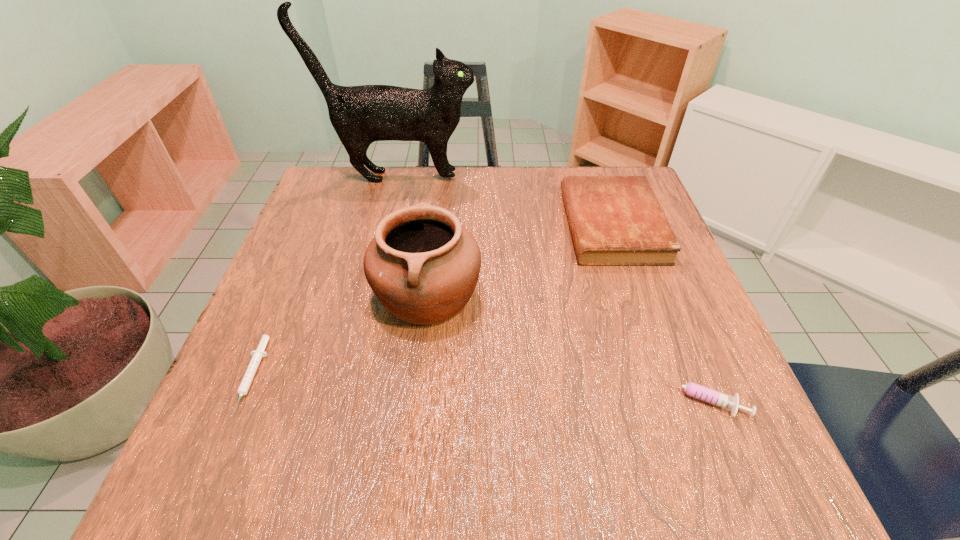
Find the location of a particular element. The height and width of the screenshot is (540, 960). vacant space situated 0.280m on the spine side of the third tallest object is located at coordinates (449, 225).

Where is `free space located on the spine side of the third tallest object`? The image size is (960, 540). free space located on the spine side of the third tallest object is located at coordinates (398, 225).

I want to click on vacant area situated on the spine side of the third tallest object, so click(x=423, y=225).

What are the coordinates of `vacant space positioned on the left of the right syringe` in the screenshot? It's located at pyautogui.click(x=438, y=399).

Find the location of a particular element. This screenshot has height=540, width=960. vacant space situated on the back of the left syringe is located at coordinates (292, 281).

Locate an element on the screen. The image size is (960, 540). cat at the far edge is located at coordinates (360, 115).

At what (x,y) coordinates should I click in order to perform the action: click on Bible that is at the far edge. Please return your answer as a coordinate pair (x, y). Looking at the image, I should click on (614, 220).

The image size is (960, 540). Identify the location of cat that is at the left edge. (360, 115).

At what (x,y) coordinates should I click in order to perform the action: click on syringe that is at the left edge. Please return your answer as a coordinate pair (x, y). The image size is (960, 540). Looking at the image, I should click on (257, 355).

Where is `Bible located in the right edge section of the desktop`? The image size is (960, 540). Bible located in the right edge section of the desktop is located at coordinates (614, 220).